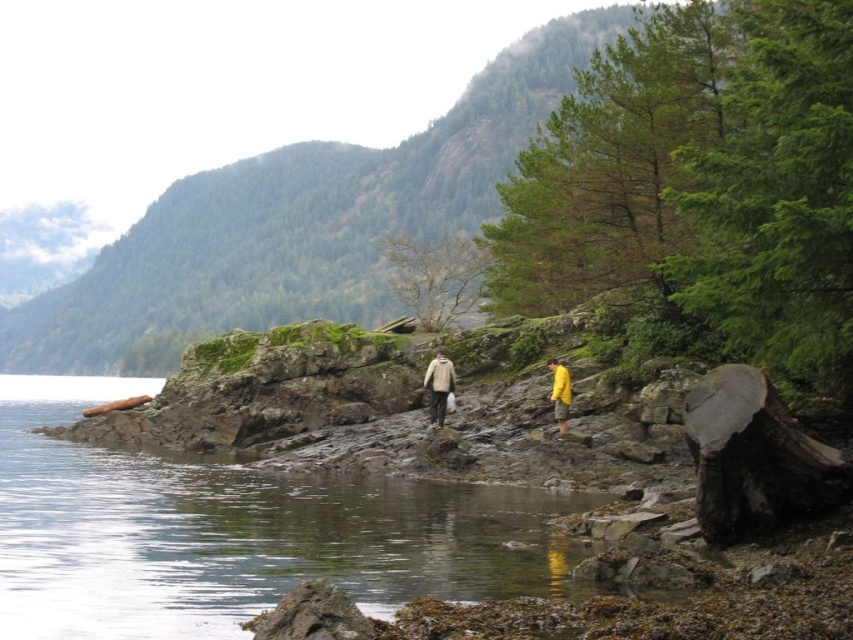
You are standing at the beach and want to pick up the beige wool sweater at center and the brown wood log at lower left. Which object is farther from your current position?

The beige wool sweater at center is 59.12 feet away from the brown wood log at lower left, so whichever object you are closer to, the other would be farther. However, since the question asks which is farther from your current position, without knowing your exact location, we can only state the distance between them. Therefore, it is impossible to determine which is farther without additional information about your position relative to both objects.

You are standing at the point marked by point (438, 387) in the image. Looking towards the rocky shoreline, which direction should you walk to reach the yellow waterproof jacket at center?

The point (438, 387) marks the yellow waterproof jacket at center, so you are already at the location of the yellow waterproof jacket at center. Therefore, no direction is needed to reach it.